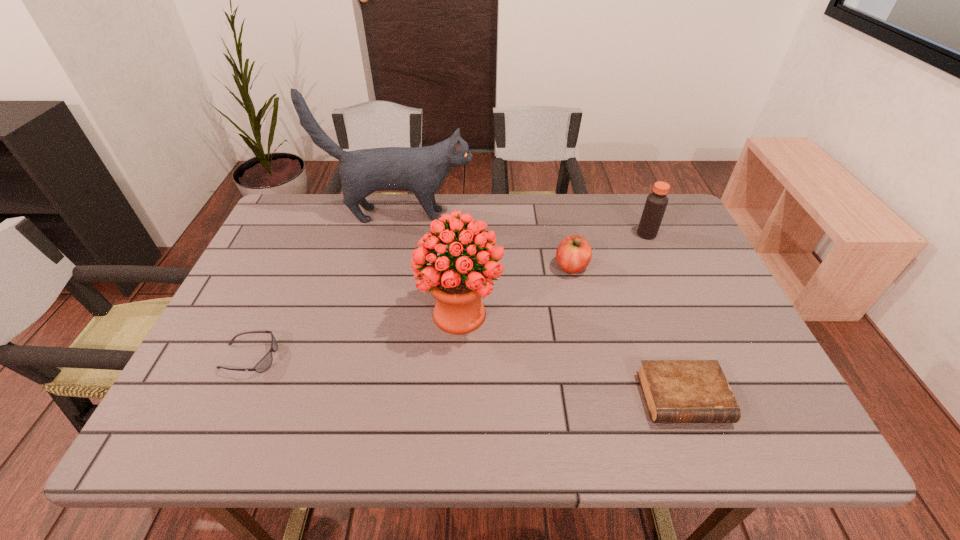
I want to click on the tallest object, so click(422, 170).

Locate an element on the screen. the farthest object is located at coordinates (422, 170).

Locate an element on the screen. This screenshot has width=960, height=540. bouquet is located at coordinates (458, 282).

Locate an element on the screen. The image size is (960, 540). the fifth nearest object is located at coordinates (656, 202).

This screenshot has width=960, height=540. Find the location of `the third tallest object`. the third tallest object is located at coordinates (656, 202).

Locate an element on the screen. This screenshot has height=540, width=960. the third shortest object is located at coordinates (573, 255).

Locate an element on the screen. The width and height of the screenshot is (960, 540). the fourth nearest object is located at coordinates (573, 255).

What are the coordinates of `diary` in the screenshot? It's located at (676, 391).

Identify the location of sunglasses. (264, 364).

Where is `free region located 0.270m at the face of the tallest object`? Image resolution: width=960 pixels, height=540 pixels. free region located 0.270m at the face of the tallest object is located at coordinates (559, 214).